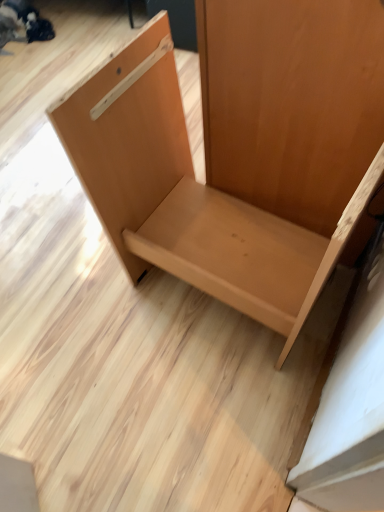
This screenshot has width=384, height=512. In order to click on vacant area that is in front of light brown wood chair at center in this screenshot , I will do `click(205, 414)`.